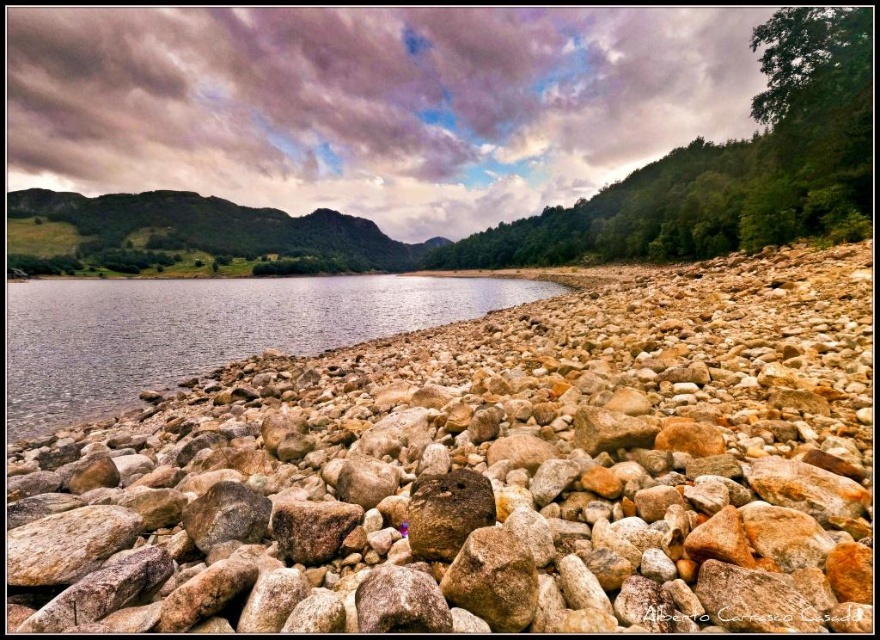
From the picture: You are standing at the point marked by the coordinates point (490, 474) in the image. Based on the scene described, what terrain feature are you most likely standing on?

A: You are standing on the brown rocky shoreline at lower left.